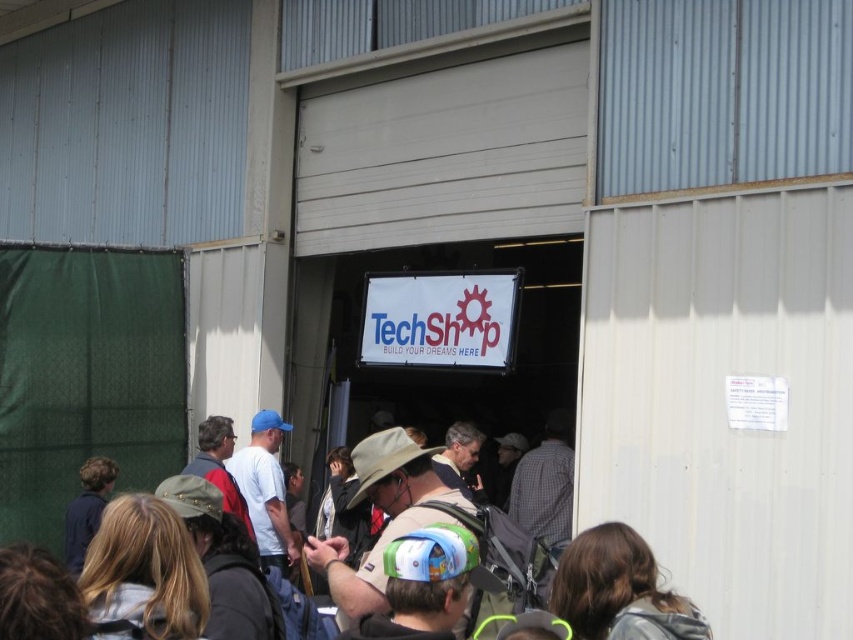
Which is in front, point (578, 589) or point (438, 342)?

Positioned in front is point (578, 589).

Does point (585, 540) come in front of point (372, 360)?

That is True.

Find the location of a particular element. brown fabric backpack at center is located at coordinates (569, 579).

Locate an element on the screen. brown fabric backpack at center is located at coordinates (569, 579).